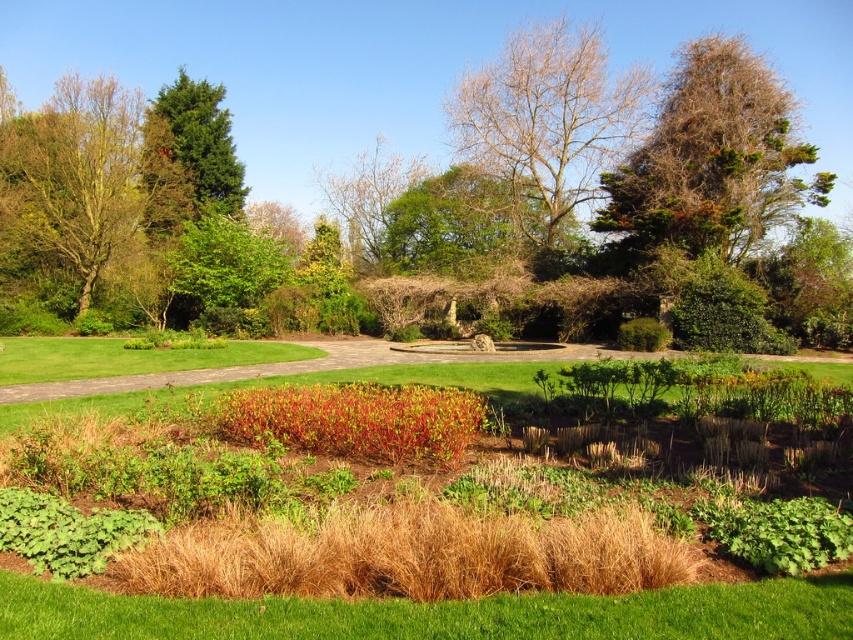
You are standing at the entrance of the garden and see the bright red foliage at center. If you were to walk directly towards it, which direction should you head? Please provide your answer as a compass direction like north, south, etc.

The bright red foliage at center is located at coordinates (357, 420). Since the garden is viewed from above, the center point would be directly ahead, so you should head north to reach it.

You are standing in the garden and want to take a photo of the bare branches at upper center. Based on their position, where should you stand to capture them in the frame?

The bare branches at upper center are located at coordinates point (548, 122), so you should position yourself in the upper center area of the garden to capture them in your photo.

You are an arborist assessing the health of trees in the garden. You notice the bare branches at upper center and the green glossy tree at upper left. Which tree has a smaller trunk diameter?

The bare branches at upper center has a smaller trunk diameter than the green glossy tree at upper left.